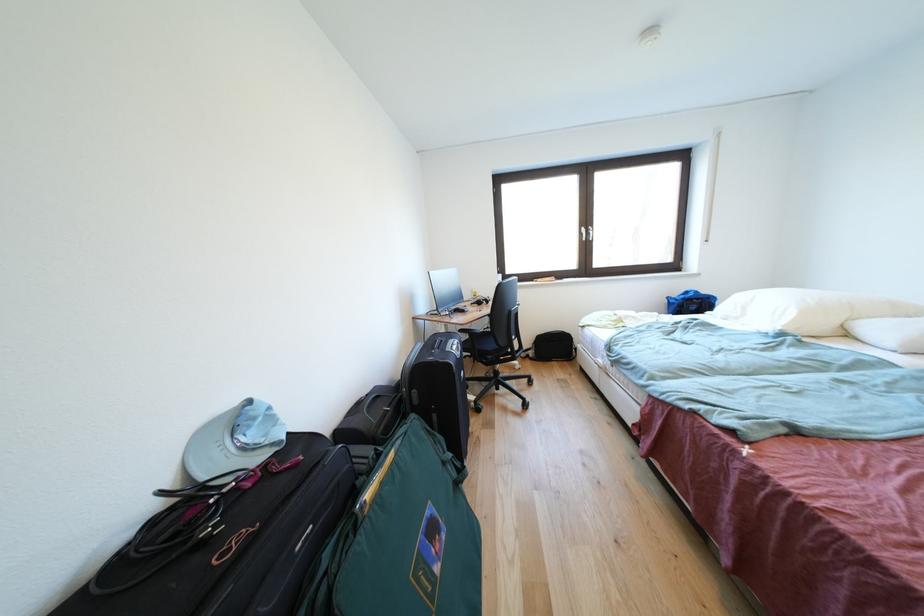
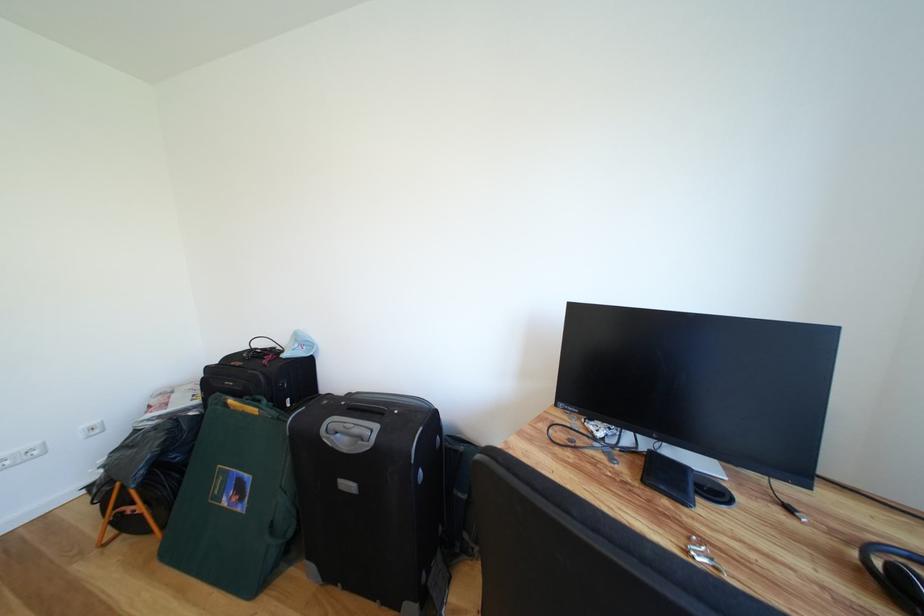
The point at (x=445, y=573) is marked in the first image. Where is the corresponding point in the second image?

(234, 506)